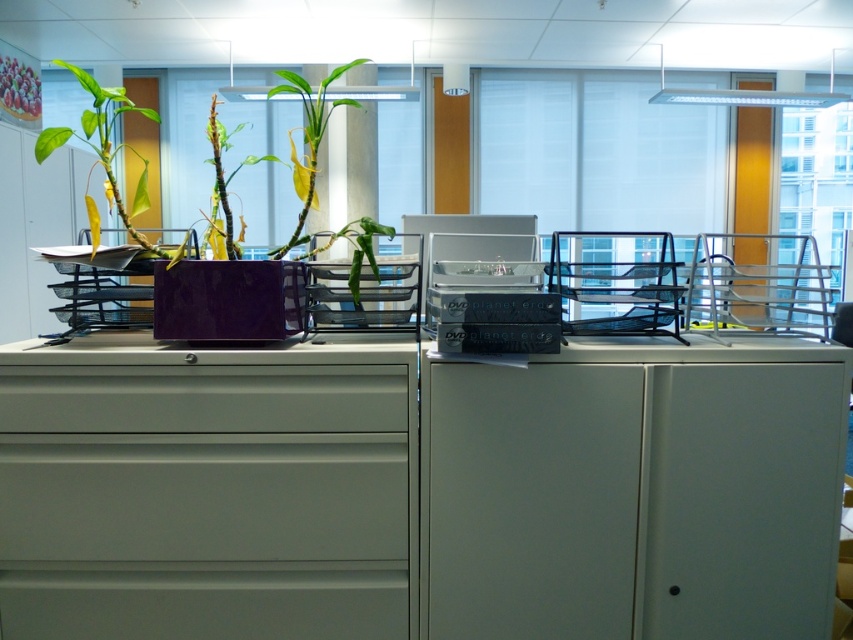
Question: Which point is closer to the camera?

Choices:
 (A) (x=279, y=412)
 (B) (x=281, y=547)
 (C) (x=221, y=236)

Answer: (A)

Question: Which of the following is the farthest from the observer?

Choices:
 (A) (370, 518)
 (B) (357, 288)
 (C) (364, 397)

Answer: (B)

Question: Is matte gray drawer at lower left closer to camera compared to green glossy plant at center?

Choices:
 (A) yes
 (B) no

Answer: (B)

Question: Is matte gray file cabinet at center thinner than matte gray drawer at center?

Choices:
 (A) no
 (B) yes

Answer: (A)

Question: Can you confirm if matte gray file cabinet at center is bigger than matte gray drawer at center?

Choices:
 (A) no
 (B) yes

Answer: (B)

Question: Which point is closer to the camera taking this photo?

Choices:
 (A) (612, 378)
 (B) (218, 172)
 (C) (10, 413)
 (D) (372, 497)

Answer: (C)